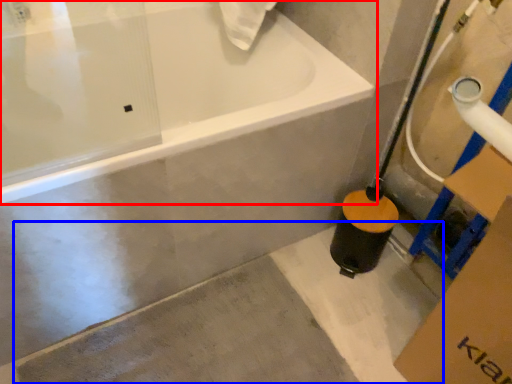
Question: Among these objects, which one is nearest to the camera, bathtub (highlighted by a red box) or concrete (highlighted by a blue box)?

Choices:
 (A) bathtub
 (B) concrete

Answer: (A)